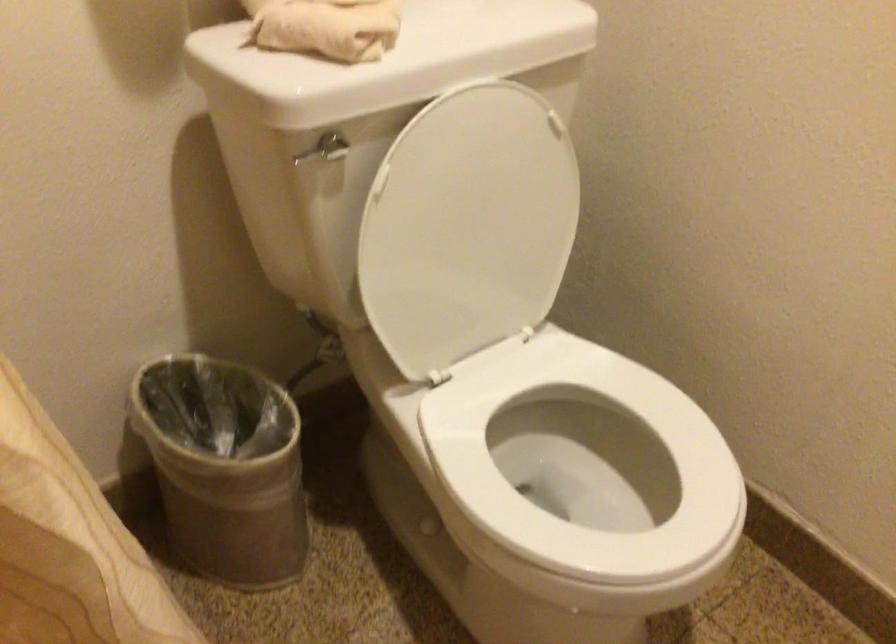
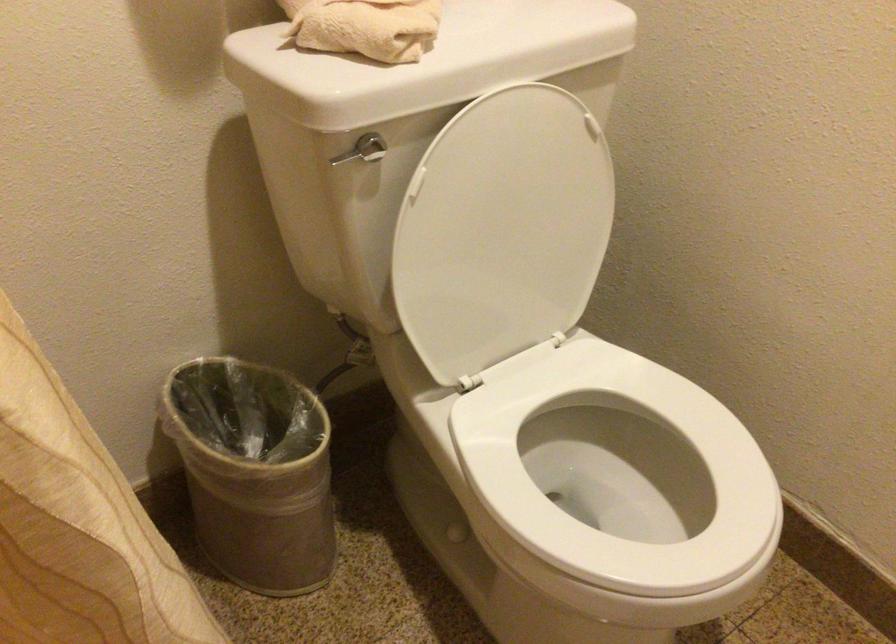
The point at (222, 469) is marked in the first image. Where is the corresponding point in the second image?

(254, 471)